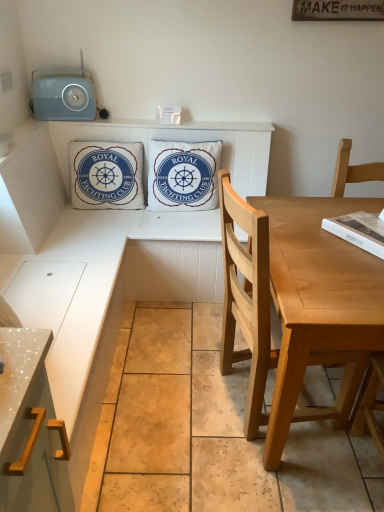
Question: Considering their positions, is light wood chair at right located in front of or behind white cotton cushion at upper center, which is counted as the 2th pillow, starting from the right?

Choices:
 (A) behind
 (B) front

Answer: (B)

Question: In terms of size, does light wood chair at right appear bigger or smaller than white cotton cushion at upper center, which is counted as the 2th pillow, starting from the right?

Choices:
 (A) small
 (B) big

Answer: (B)

Question: Which of these objects is positioned closest to the light wood chair at right?

Choices:
 (A) metallic gold cabinet handle at lower left
 (B) matte blue radio at upper left
 (C) white cotton cushion at center, the second pillow when ordered from left to right
 (D) white cotton cushion at upper center, which is counted as the 2th pillow, starting from the right

Answer: (A)

Question: Which object is positioned closest to the metallic gold cabinet handle at lower left?

Choices:
 (A) light wood chair at right
 (B) white cotton cushion at upper center, the first pillow viewed from the left
 (C) white cotton cushion at center, positioned as the 1th pillow in right-to-left order
 (D) matte blue radio at upper left

Answer: (A)